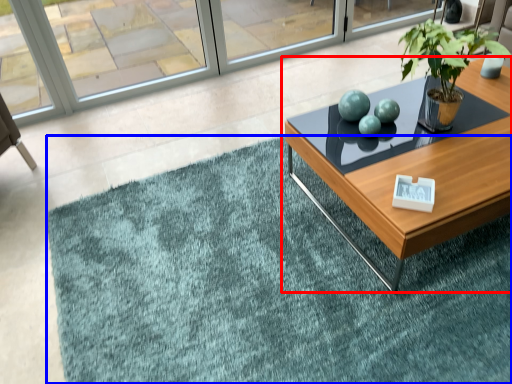
Question: Which object appears closest to the camera in this image, coffee table (highlighted by a red box) or doormat (highlighted by a blue box)?

Choices:
 (A) coffee table
 (B) doormat

Answer: (B)